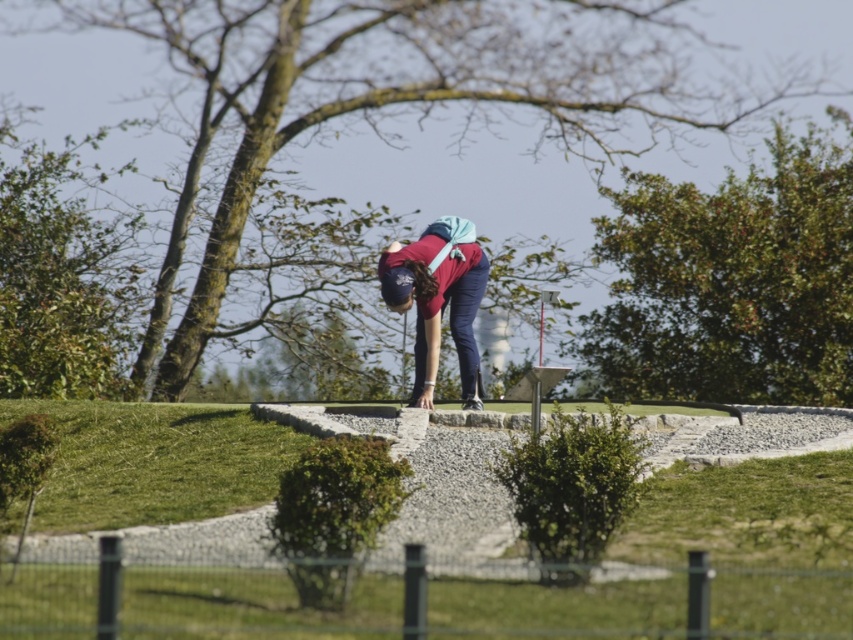
Can you confirm if smooth gravel path at center is positioned below matte red shirt at center?

Yes.

Is the position of smooth gravel path at center less distant than that of matte red shirt at center?

Yes, smooth gravel path at center is in front of matte red shirt at center.

Is point (828, 616) less distant than point (463, 259)?

Yes, point (828, 616) is closer to viewer.

I want to click on smooth gravel path at center, so click(392, 570).